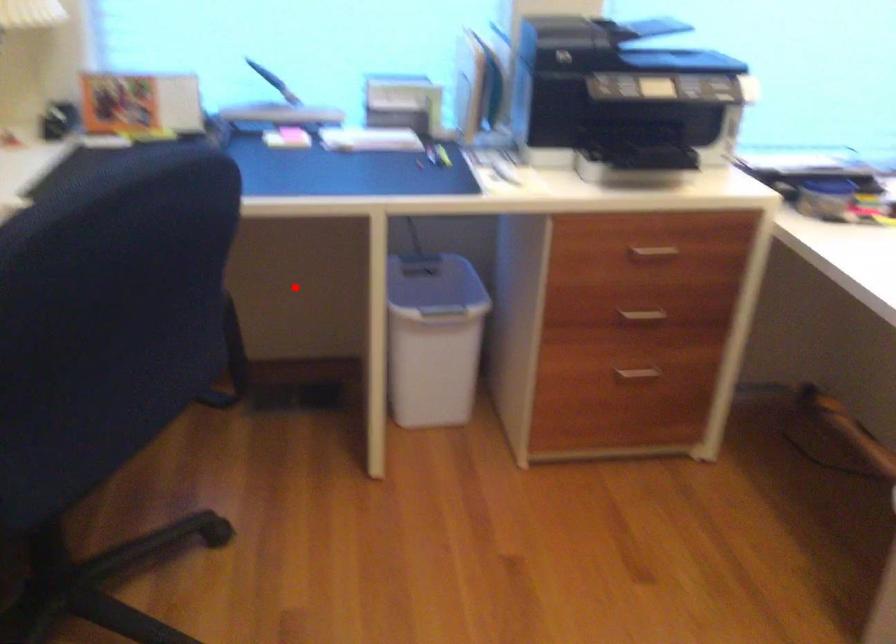
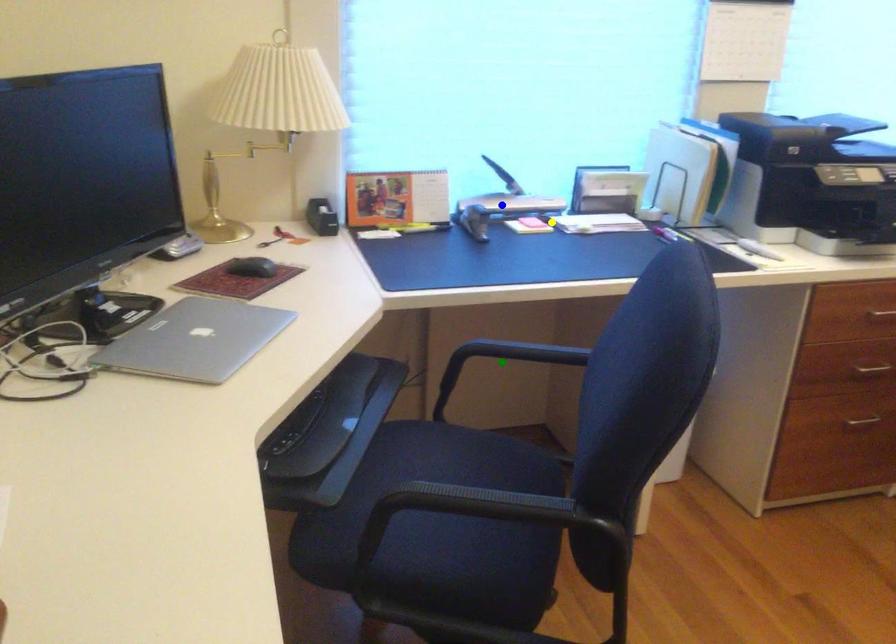
Question: I am providing you with two images of the same scene from different viewpoints. A red point is marked on the first image. You are given multiple points on the second image. Which mark in image 2 goes with the point in image 1?

Choices:
 (A) yellow point
 (B) green point
 (C) blue point

Answer: (B)